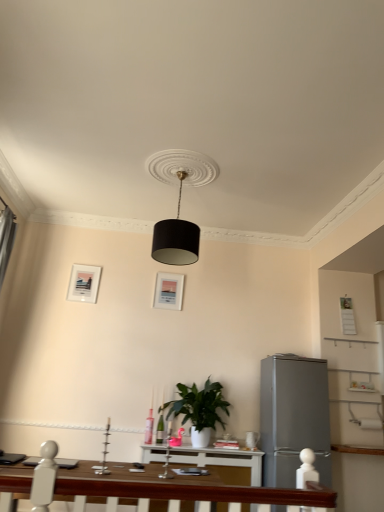
This screenshot has width=384, height=512. What do you see at coordinates (84, 283) in the screenshot? I see `matte white picture frame at upper left, arranged as the first picture frame when viewed from the left` at bounding box center [84, 283].

Find the location of a particular element. Image resolution: width=384 pixels, height=512 pixels. green matte plant at center is located at coordinates pyautogui.click(x=199, y=409).

Which object is positioned more to the right, black matte lampshade at center or green matte plant at center?

From the viewer's perspective, green matte plant at center appears more on the right side.

Which is in front, point (191, 247) or point (192, 431)?

Positioned in front is point (191, 247).

Is black matte lampshade at center in front of green matte plant at center?

That is True.

From the image's perspective, is black matte lampshade at center located above green matte plant at center?

Yes, from the image's perspective, black matte lampshade at center is above green matte plant at center.

In terms of height, does matte white picture frame at upper left, arranged as the first picture frame when viewed from the left, look taller or shorter compared to satin silver refrigerator at right?

Considering their sizes, matte white picture frame at upper left, arranged as the first picture frame when viewed from the left, has less height than satin silver refrigerator at right.

Does matte white picture frame at upper left, arranged as the 2th picture frame when viewed from the right, turn towards satin silver refrigerator at right?

No, matte white picture frame at upper left, arranged as the 2th picture frame when viewed from the right, is not oriented towards satin silver refrigerator at right.

Does matte white picture frame at upper left, arranged as the 2th picture frame when viewed from the right, appear on the right side of satin silver refrigerator at right?

Incorrect, matte white picture frame at upper left, arranged as the 2th picture frame when viewed from the right, is not on the right side of satin silver refrigerator at right.

From the image's perspective, starting from the satin silver refrigerator at right, which picture frame is the 2nd one above? Please provide its 2D coordinates.

[(84, 283)]

Do you think matte white picture frame at upper left, arranged as the 2th picture frame when viewed from the right, is within white matte picture frame at center, the second picture frame when ordered from left to right, or outside of it?

matte white picture frame at upper left, arranged as the 2th picture frame when viewed from the right, cannot be found inside white matte picture frame at center, the second picture frame when ordered from left to right.

Which object is positioned more to the right, matte white picture frame at upper left, arranged as the 2th picture frame when viewed from the right, or white matte picture frame at center, positioned as the first picture frame in right-to-left order?

white matte picture frame at center, positioned as the first picture frame in right-to-left order, is more to the right.

Is matte white picture frame at upper left, arranged as the first picture frame when viewed from the left, looking in the opposite direction of white matte picture frame at center, the second picture frame when ordered from left to right?

No, matte white picture frame at upper left, arranged as the first picture frame when viewed from the left, is not facing the opposite direction of white matte picture frame at center, the second picture frame when ordered from left to right.

Does black matte lampshade at center have a smaller size compared to satin silver refrigerator at right?

Yes, black matte lampshade at center is smaller than satin silver refrigerator at right.

Is black matte lampshade at center next to satin silver refrigerator at right?

No, black matte lampshade at center is not in contact with satin silver refrigerator at right.

From the image's perspective, is black matte lampshade at center over satin silver refrigerator at right?

Yes, from the image's perspective, black matte lampshade at center is on top of satin silver refrigerator at right.

Is point (276, 442) positioned before point (161, 276)?

Yes.

Which object is closer to the camera, satin silver refrigerator at right or white matte picture frame at center, the second picture frame when ordered from left to right?

satin silver refrigerator at right is in front.

Between satin silver refrigerator at right and white matte picture frame at center, the second picture frame when ordered from left to right, which one has larger size?

satin silver refrigerator at right is bigger.

From a real-world perspective, starting from the satin silver refrigerator at right, which picture frame is the 2nd one vertically above it? Please provide its 2D coordinates.

[(168, 291)]

Is point (180, 288) positioned after point (290, 362)?

Yes.

Consider the image. In terms of size, does white matte picture frame at center, positioned as the first picture frame in right-to-left order, appear bigger or smaller than satin silver refrigerator at right?

In the image, white matte picture frame at center, positioned as the first picture frame in right-to-left order, appears to be smaller than satin silver refrigerator at right.

Looking at this image, how different are the orientations of white matte picture frame at center, the second picture frame when ordered from left to right, and satin silver refrigerator at right in degrees?

The angular difference between white matte picture frame at center, the second picture frame when ordered from left to right, and satin silver refrigerator at right is 0.000147 degrees.

Is white matte picture frame at center, the second picture frame when ordered from left to right, spatially inside satin silver refrigerator at right, or outside of it?

white matte picture frame at center, the second picture frame when ordered from left to right, is not enclosed by satin silver refrigerator at right.

From a real-world perspective, is green matte plant at center positioned above or below satin silver refrigerator at right?

From a real-world perspective, green matte plant at center is physically above satin silver refrigerator at right.

The height and width of the screenshot is (512, 384). Find the location of `appliance in front of the green matte plant at center`. appliance in front of the green matte plant at center is located at coordinates (293, 418).

Is green matte plant at center in contact with satin silver refrigerator at right?

green matte plant at center and satin silver refrigerator at right are clearly separated.

Is point (207, 390) closer or farther from the camera than point (274, 510)?

Point (207, 390) is positioned farther from the camera compared to point (274, 510).

You are a GUI agent. You are given a task and a screenshot of the screen. Output one action in this format:
    pyautogui.click(x=<x>, y=<y>)
    Task: Click on the lamp that appears above the green matte plant at center (from a real-world perspective)
    The height and width of the screenshot is (512, 384).
    Given the screenshot: What is the action you would take?
    pyautogui.click(x=179, y=204)

Locate an element on the screen. appliance below the matte white picture frame at upper left, arranged as the first picture frame when viewed from the left (from a real-world perspective) is located at coordinates (293, 418).

Looking at the image, which one is located closer to green matte plant at center, satin silver refrigerator at right or white matte picture frame at center, the second picture frame when ordered from left to right?

satin silver refrigerator at right is positioned closer to the anchor green matte plant at center.

Consider the image. When comparing their distances from satin silver refrigerator at right, does white matte picture frame at center, positioned as the first picture frame in right-to-left order, or black matte lampshade at center seem further?

black matte lampshade at center is further to satin silver refrigerator at right.

Based on their spatial positions, is black matte lampshade at center or white matte picture frame at center, the second picture frame when ordered from left to right, closer to green matte plant at center?

white matte picture frame at center, the second picture frame when ordered from left to right, is positioned closer to the anchor green matte plant at center.

Based on their spatial positions, is satin silver refrigerator at right or green matte plant at center closer to matte white picture frame at upper left, arranged as the first picture frame when viewed from the left?

Among the two, green matte plant at center is located nearer to matte white picture frame at upper left, arranged as the first picture frame when viewed from the left.

Looking at the image, which one is located closer to satin silver refrigerator at right, matte white picture frame at upper left, arranged as the 2th picture frame when viewed from the right, or black matte lampshade at center?

Based on the image, black matte lampshade at center appears to be nearer to satin silver refrigerator at right.

From the image, which object appears to be nearer to green matte plant at center, satin silver refrigerator at right or matte white picture frame at upper left, arranged as the first picture frame when viewed from the left?

Among the two, satin silver refrigerator at right is located nearer to green matte plant at center.

Which object lies nearer to the anchor point black matte lampshade at center, satin silver refrigerator at right or matte white picture frame at upper left, arranged as the first picture frame when viewed from the left?

Based on the image, matte white picture frame at upper left, arranged as the first picture frame when viewed from the left, appears to be nearer to black matte lampshade at center.

Considering their positions, is white matte picture frame at center, positioned as the first picture frame in right-to-left order, positioned closer to black matte lampshade at center than green matte plant at center?

white matte picture frame at center, positioned as the first picture frame in right-to-left order, is closer to black matte lampshade at center.

I want to click on lamp situated between matte white picture frame at upper left, arranged as the 2th picture frame when viewed from the right, and satin silver refrigerator at right from left to right, so click(x=179, y=204).

In order to click on picture frame between matte white picture frame at upper left, arranged as the 2th picture frame when viewed from the right, and satin silver refrigerator at right from left to right in this screenshot , I will do `click(168, 291)`.

At what (x,y) coordinates should I click in order to perform the action: click on picture frame between black matte lampshade at center and white matte picture frame at center, positioned as the first picture frame in right-to-left order, from front to back. Please return your answer as a coordinate pair (x, y). Image resolution: width=384 pixels, height=512 pixels. Looking at the image, I should click on (84, 283).

The width and height of the screenshot is (384, 512). Find the location of `houseplant between black matte lampshade at center and satin silver refrigerator at right vertically`. houseplant between black matte lampshade at center and satin silver refrigerator at right vertically is located at coordinates (199, 409).